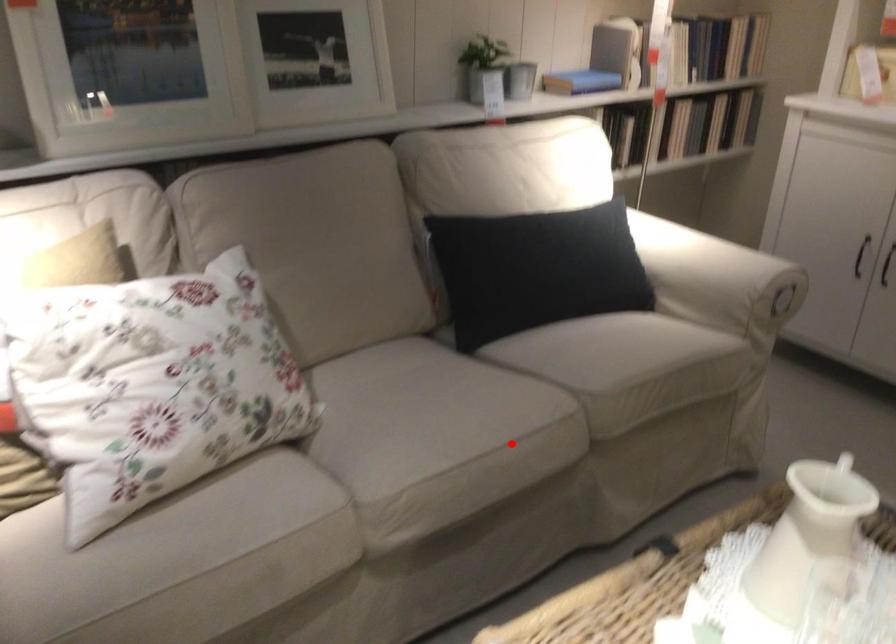
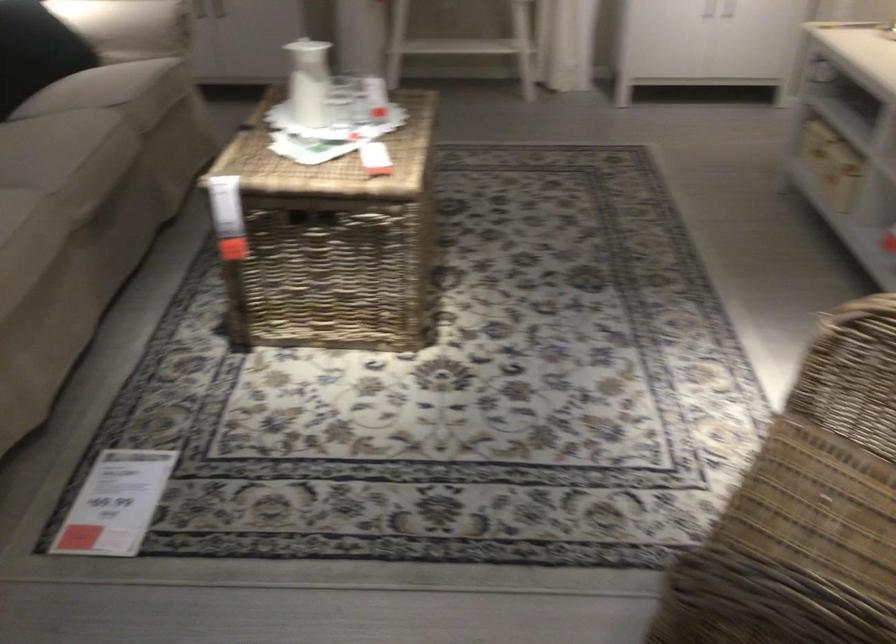
The point at the highlighted location is marked in the first image. Where is the corresponding point in the second image?

(109, 140)